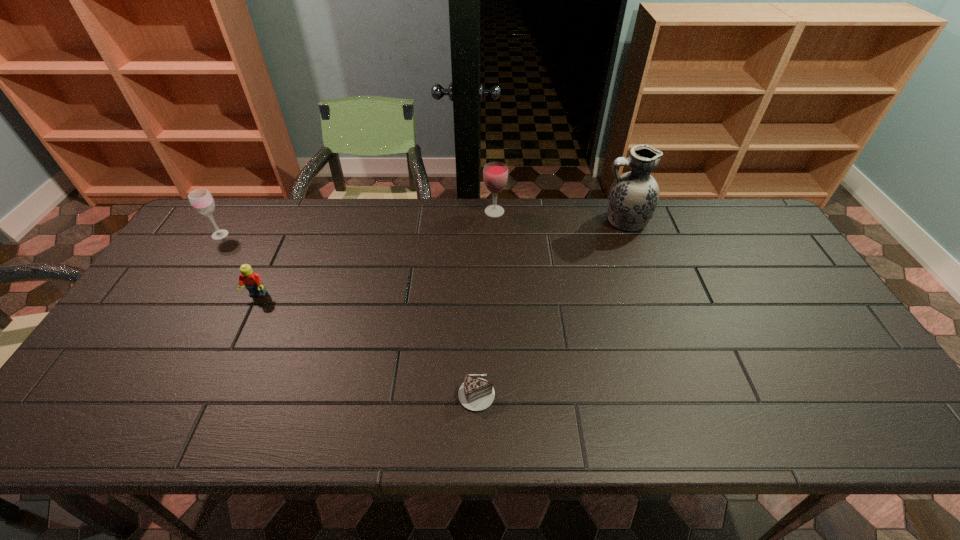
The height and width of the screenshot is (540, 960). What are the coordinates of `free location located with the handle on the side of the rightmost object` in the screenshot? It's located at (520, 221).

Locate an element on the screen. The image size is (960, 540). blank space located 0.220m with the handle on the side of the rightmost object is located at coordinates (533, 221).

Find the location of a particular element. This screenshot has width=960, height=540. vacant space located 0.330m on the front of the farther wineglass is located at coordinates (497, 293).

Locate an element on the screen. vacant point located 0.120m on the front of the nearer wineglass is located at coordinates (199, 268).

This screenshot has width=960, height=540. Identify the location of free location located on the face of the fourth farthest object. (204, 407).

Locate an element on the screen. The image size is (960, 540). blank area located 0.260m on the back of the nearest object is located at coordinates (477, 294).

At what (x,y) coordinates should I click in order to perform the action: click on vase that is at the far edge. Please return your answer as a coordinate pair (x, y). Looking at the image, I should click on (633, 197).

Where is `object that is at the near edge`? object that is at the near edge is located at coordinates [x=476, y=394].

Find the location of a particular element. object that is at the left edge is located at coordinates (201, 200).

Locate an element on the screen. Image resolution: width=960 pixels, height=540 pixels. object that is at the far left corner is located at coordinates (201, 200).